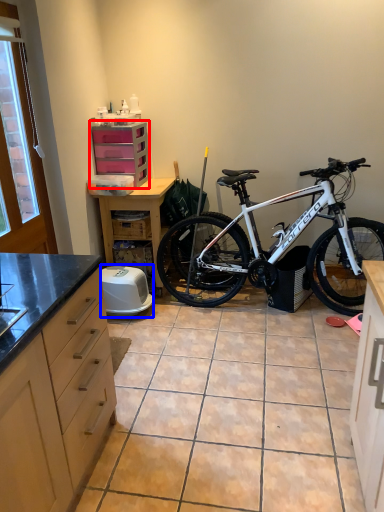
Question: Which of the following is the closest to the observer, chest of drawers (highlighted by a red box) or appliance (highlighted by a blue box)?

Choices:
 (A) chest of drawers
 (B) appliance

Answer: (B)